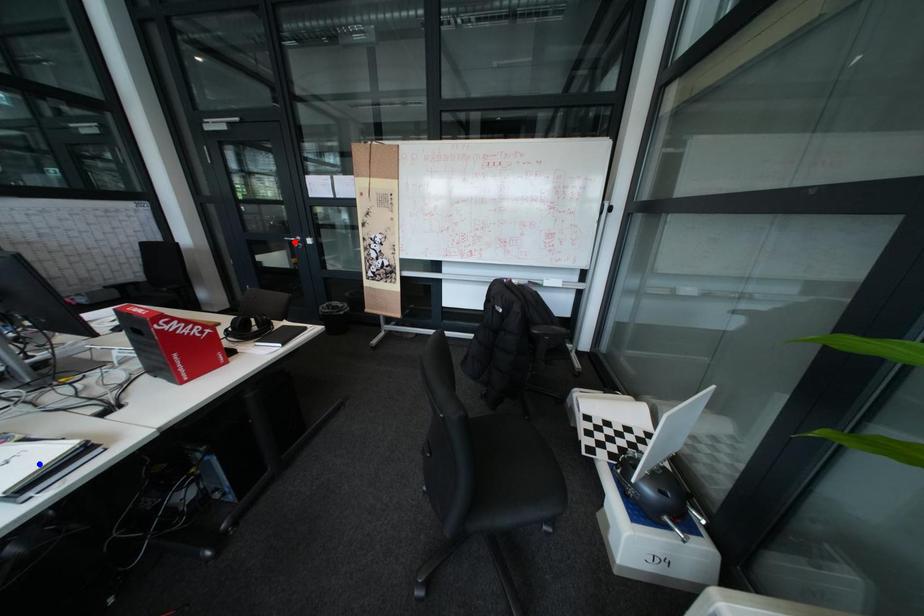
Question: In the image, two points are highlighted. Which point is nearer to the camera? Reply with the corresponding letter.

Choices:
 (A) blue point
 (B) red point

Answer: (A)